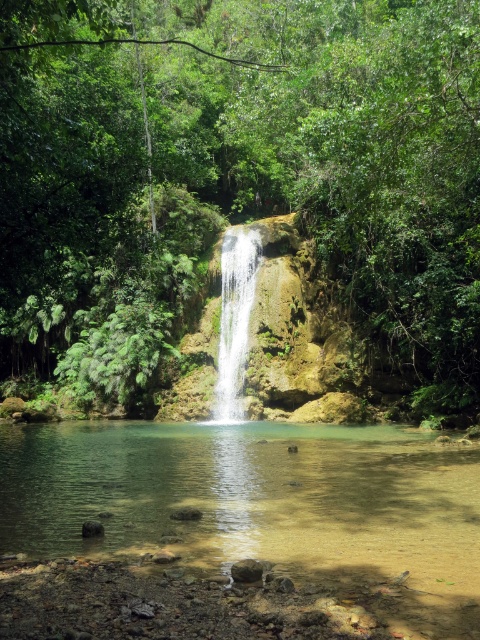
You are standing at the edge of the clear water at center and want to reach the white smooth waterfall at center. The path you need to take is straight and has no obstacles. If your maximum walking distance is 15 meters, will you be able to reach the waterfall without stopping?

The clear water at center is 13.47 meters away from the white smooth waterfall at center. Since your maximum walking distance is 15 meters, you can reach the waterfall without stopping.

You are standing at the edge of the pool at the base of the waterfall. You see a point marked at coordinates (238, 182). Which object in the scene is this point located on?

The point at coordinates (238, 182) is located on the green leafy tree at center.